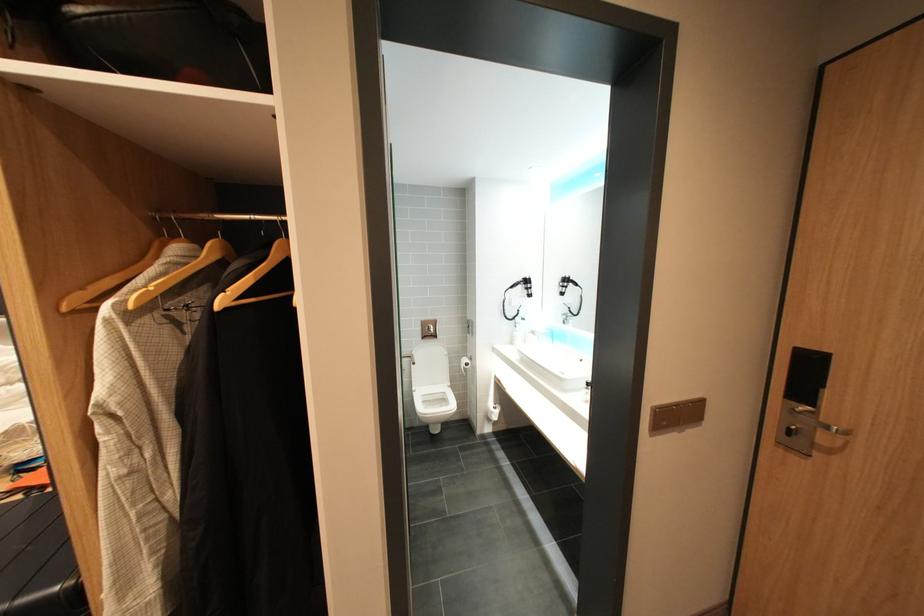
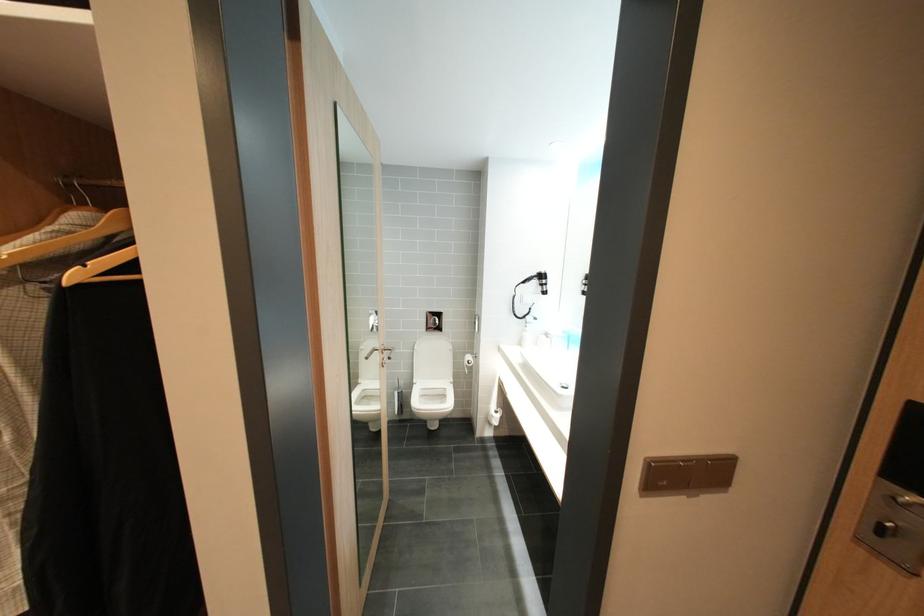
In the second image, find the point that corresponds to point (799, 430) in the first image.

(891, 527)